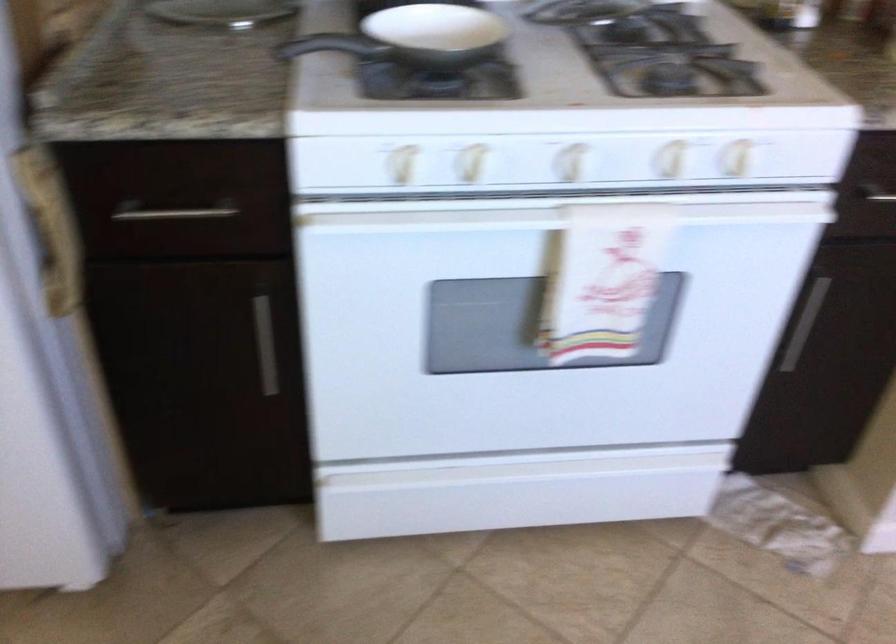
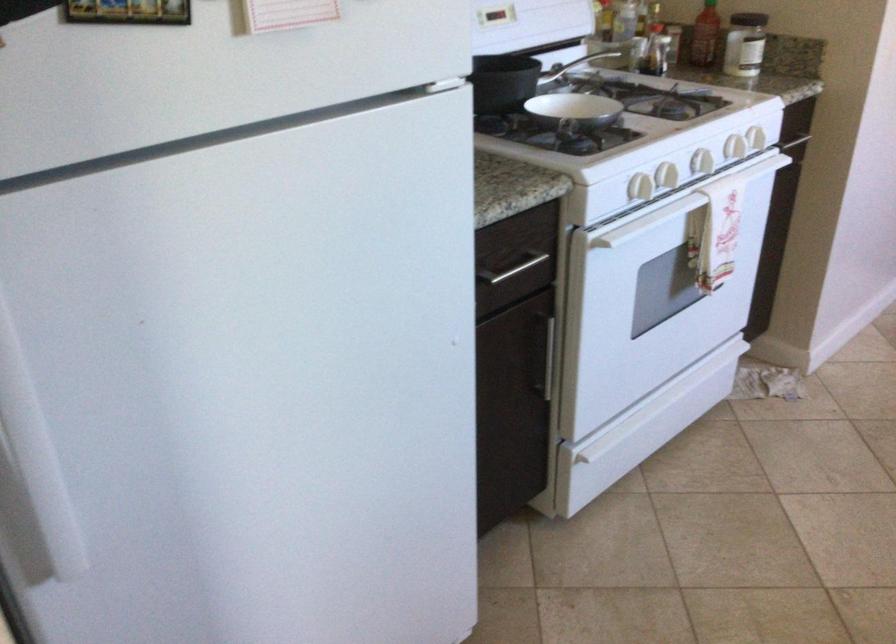
Question: I am providing you with two images of the same scene from different viewpoints. After the viewpoint changes to image2, which objects are now occluded?

Choices:
 (A) Prince cereal box
 (B) white stove knob
 (C) silver cabinet handle
 (D) spice jar

Answer: (C)